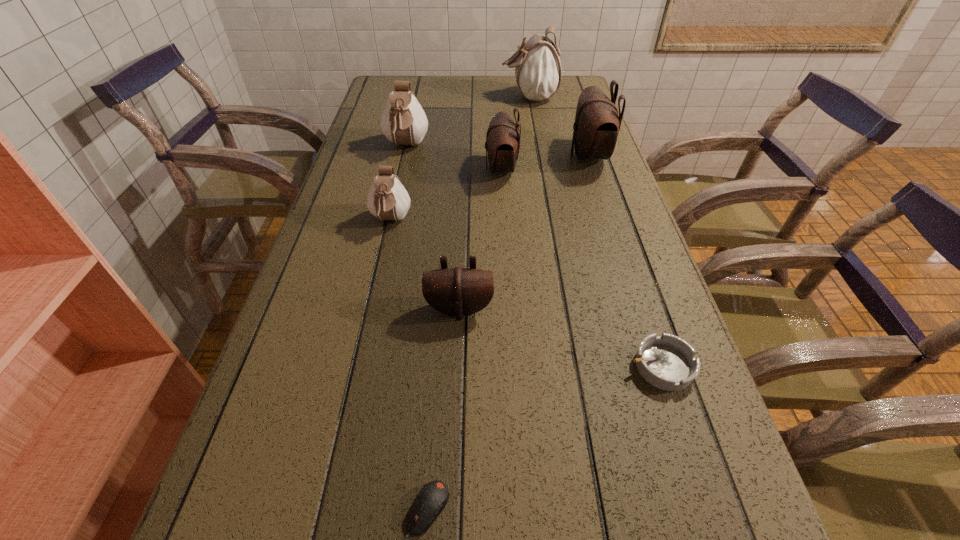
Locate which pouch is the third closest to the second smallest brown pouch. Please provide its 2D coordinates. Your answer should be formatted as a tuple, i.e. [(x, y)], where the tuple contains the x and y coordinates of a point satisfying the conditions above.

[(387, 199)]

Choose which pouch is the fourth nearest neighbor to the second farthest white pouch. Please provide its 2D coordinates. Your answer should be formatted as a tuple, i.e. [(x, y)], where the tuple contains the x and y coordinates of a point satisfying the conditions above.

[(597, 124)]

Image resolution: width=960 pixels, height=540 pixels. I want to click on white pouch that is the third nearest to the nearest pouch, so click(x=537, y=65).

Select which white pouch is the closest to the computer mouse. Please provide its 2D coordinates. Your answer should be formatted as a tuple, i.e. [(x, y)], where the tuple contains the x and y coordinates of a point satisfying the conditions above.

[(387, 199)]

Locate which brown pouch ranks second in proximity to the ashtray. Please provide its 2D coordinates. Your answer should be formatted as a tuple, i.e. [(x, y)], where the tuple contains the x and y coordinates of a point satisfying the conditions above.

[(502, 145)]

Find the location of a particular element. Image resolution: width=960 pixels, height=540 pixels. brown pouch that is the second nearest to the sixth farthest object is located at coordinates (597, 124).

Locate an element on the screen. free space in the image that satisfies the following two spatial constraints: 1. with the flap open on the rightmost brown pouch; 2. on the back side of the seventh tallest object is located at coordinates (657, 366).

The height and width of the screenshot is (540, 960). Find the location of `free space that satisfies the following two spatial constraints: 1. on the front-facing side of the seventh tallest object; 2. on the right side of the fifth farthest pouch`. free space that satisfies the following two spatial constraints: 1. on the front-facing side of the seventh tallest object; 2. on the right side of the fifth farthest pouch is located at coordinates (358, 366).

Locate an element on the screen. vacant region that satisfies the following two spatial constraints: 1. with the flap open on the biggest brown pouch; 2. on the front-facing side of the fifth farthest object is located at coordinates (610, 221).

Identify the location of free spot that satisfies the following two spatial constraints: 1. on the front-facing side of the farthest pouch; 2. on the front-facing side of the nearest white pouch. This screenshot has height=540, width=960. (552, 221).